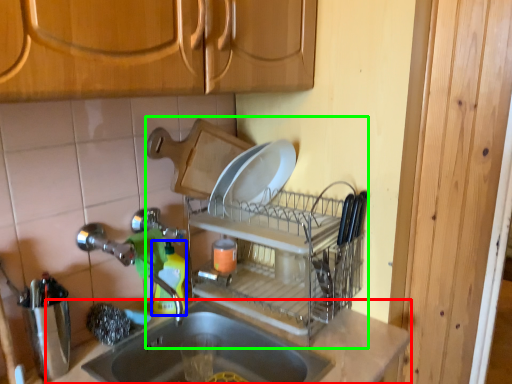
Question: Which object is positioned closest to countertop (highlighted by a red box)? Select from bottle (highlighted by a blue box) and dish washer (highlighted by a green box).

Choices:
 (A) bottle
 (B) dish washer

Answer: (B)